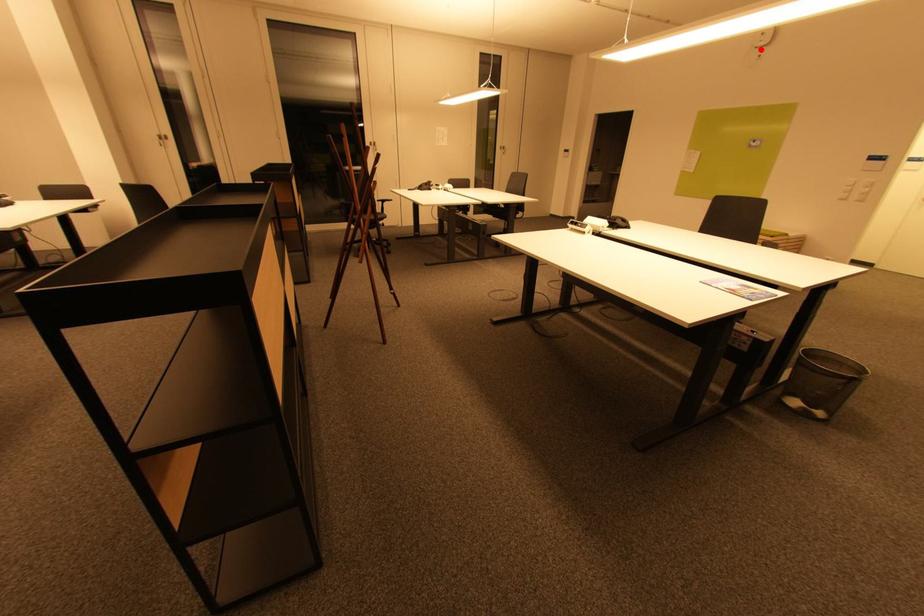
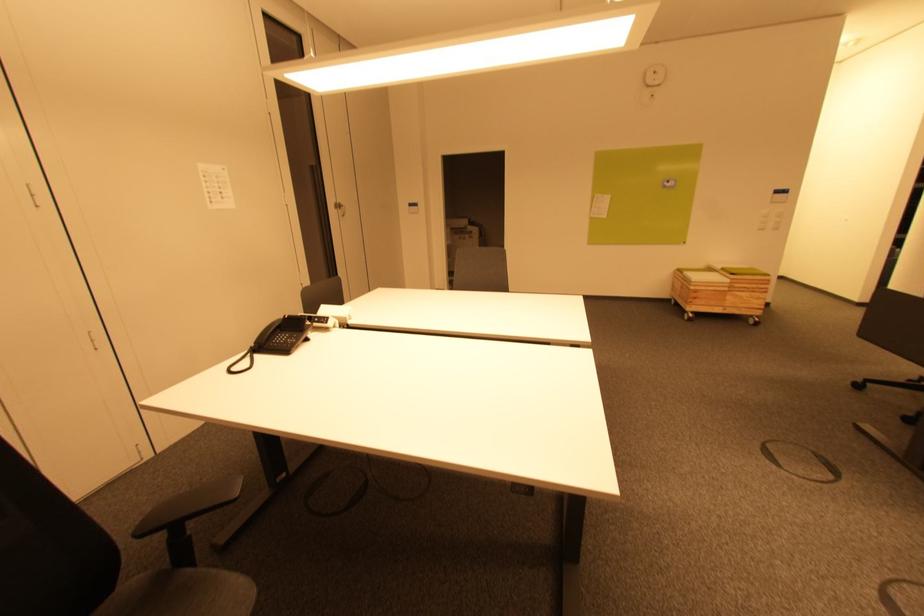
Find the pixel in the second image that matches the highlighted location in the first image.

(652, 87)